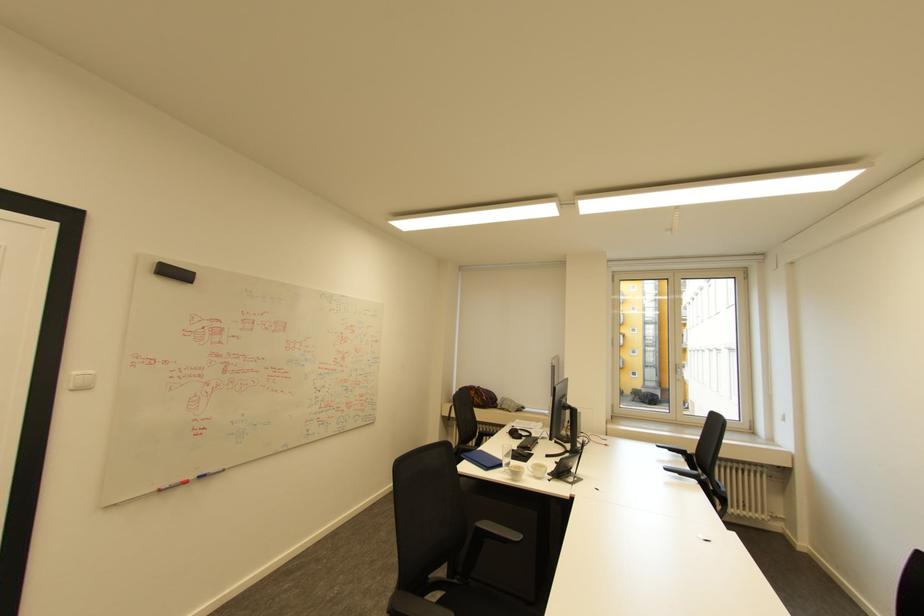
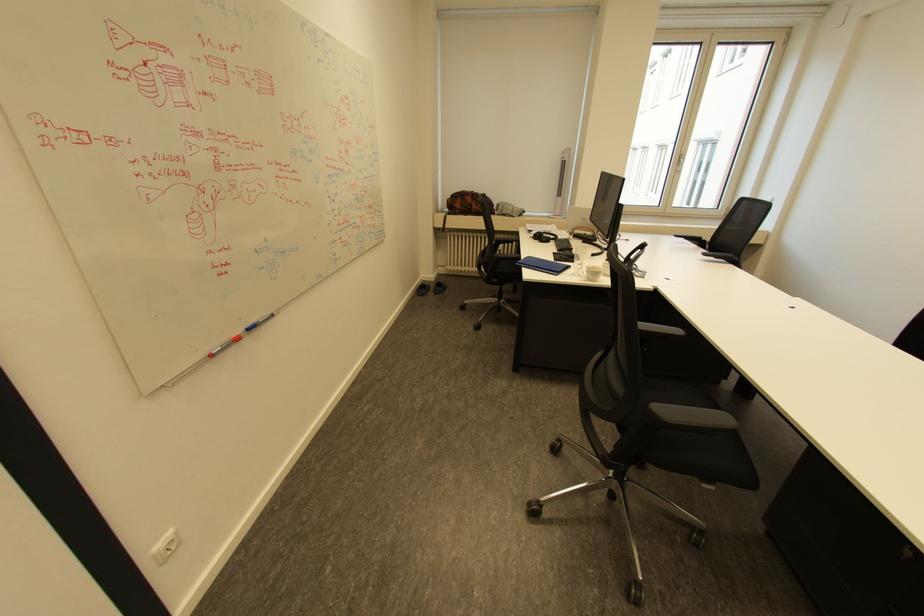
Find the pixel in the second image that matches [506,464] in the first image.

(575, 268)